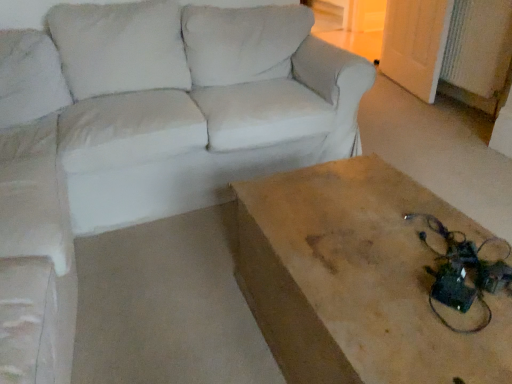
What do you see at coordinates (159, 114) in the screenshot? This screenshot has width=512, height=384. I see `white fabric couch at upper left` at bounding box center [159, 114].

I want to click on white fabric couch at upper left, so click(x=159, y=114).

Measure the distance between wooden table at center and camera.

The distance of wooden table at center from camera is 77.75 centimeters.

This screenshot has height=384, width=512. What are the coordinates of `wooden table at center` in the screenshot? It's located at (362, 279).

Image resolution: width=512 pixels, height=384 pixels. Describe the element at coordinates (362, 279) in the screenshot. I see `wooden table at center` at that location.

Locate an element on the screen. The image size is (512, 384). white fabric couch at upper left is located at coordinates (159, 114).

Does white fabric couch at upper left appear on the right side of wooden table at center?

No.

In the image, is white fabric couch at upper left positioned in front of or behind wooden table at center?

Visually, white fabric couch at upper left is located behind wooden table at center.

Is point (121, 162) positioned in front of point (364, 350)?

No, (121, 162) is further to viewer.

From the image's perspective, relative to wooden table at center, is white fabric couch at upper left above or below?

Clearly, from the image's perspective, white fabric couch at upper left is above wooden table at center.

In the scene shown: From a real-world perspective, is white fabric couch at upper left physically below wooden table at center?

Indeed, from a real-world perspective, white fabric couch at upper left is positioned beneath wooden table at center.

Between white fabric couch at upper left and wooden table at center, which one has smaller width?

With smaller width is wooden table at center.

Considering the sizes of objects white fabric couch at upper left and wooden table at center in the image provided, who is taller, white fabric couch at upper left or wooden table at center?

wooden table at center is taller.

Considering the relative sizes of white fabric couch at upper left and wooden table at center in the image provided, is white fabric couch at upper left bigger than wooden table at center?

Yes, white fabric couch at upper left is bigger than wooden table at center.

In the scene shown: Which is correct: white fabric couch at upper left is inside wooden table at center, or outside of it?

white fabric couch at upper left is outside wooden table at center.

Is white fabric couch at upper left far away from wooden table at center?

No, white fabric couch at upper left is not far away from wooden table at center.

Is white fabric couch at upper left oriented away from wooden table at center?

No, white fabric couch at upper left is not facing away from wooden table at center.

What's the angular difference between white fabric couch at upper left and wooden table at center's facing directions?

They differ by 87.9 degrees in their facing directions.

How distant is white fabric couch at upper left from wooden table at center?

white fabric couch at upper left and wooden table at center are 32.91 inches apart.

Identify the location of table in front of the white fabric couch at upper left. (362, 279).

Is wooden table at center to the left of white fabric couch at upper left from the viewer's perspective?

Incorrect, wooden table at center is not on the left side of white fabric couch at upper left.

Considering their positions, is wooden table at center located in front of or behind white fabric couch at upper left?

Clearly, wooden table at center is in front of white fabric couch at upper left.

Considering the positions of point (296, 346) and point (12, 146), is point (296, 346) closer or farther from the camera than point (12, 146)?

Point (296, 346) is closer to the camera than point (12, 146).

From the image's perspective, relative to white fabric couch at upper left, is wooden table at center above or below?

wooden table at center is situated lower than white fabric couch at upper left in the image.

From a real-world perspective, is wooden table at center physically above white fabric couch at upper left?

Yes.

Considering the sizes of wooden table at center and white fabric couch at upper left in the image, is wooden table at center wider or thinner than white fabric couch at upper left?

In the image, wooden table at center appears to be more narrow than white fabric couch at upper left.

Can you confirm if wooden table at center is taller than white fabric couch at upper left?

Correct, wooden table at center is much taller as white fabric couch at upper left.

Does wooden table at center have a smaller size compared to white fabric couch at upper left?

Yes.

Is wooden table at center positioned beyond the bounds of white fabric couch at upper left?

Yes.

Is there a large distance between wooden table at center and white fabric couch at upper left?

No, wooden table at center is not far away from white fabric couch at upper left.

Based on the photo, is wooden table at center positioned with its back to white fabric couch at upper left?

No.

How different are the orientations of wooden table at center and white fabric couch at upper left in degrees?

87.9 degrees separate the facing orientations of wooden table at center and white fabric couch at upper left.

Identify the location of studio couch behind the wooden table at center. (159, 114).

Find the location of a particular element. table on the right of white fabric couch at upper left is located at coordinates (362, 279).

Where is `table that is in front of the white fabric couch at upper left`? This screenshot has width=512, height=384. table that is in front of the white fabric couch at upper left is located at coordinates click(x=362, y=279).